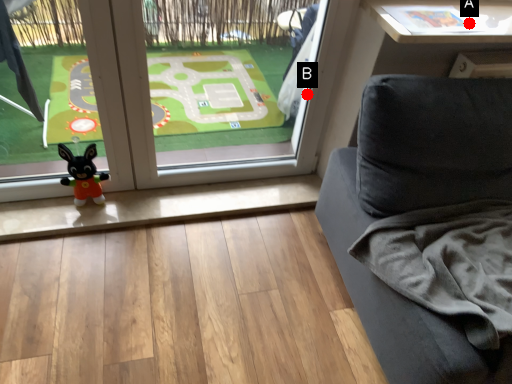
Question: Two points are circled on the image, labeled by A and B beside each circle. Which point appears closest to the camera in this image?

Choices:
 (A) A is closer
 (B) B is closer

Answer: (A)